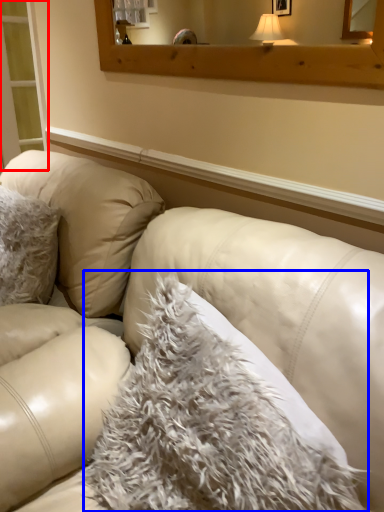
Question: Which point is closer to the camera, screen door (highlighted by a red box) or blanket (highlighted by a blue box)?

Choices:
 (A) screen door
 (B) blanket

Answer: (B)